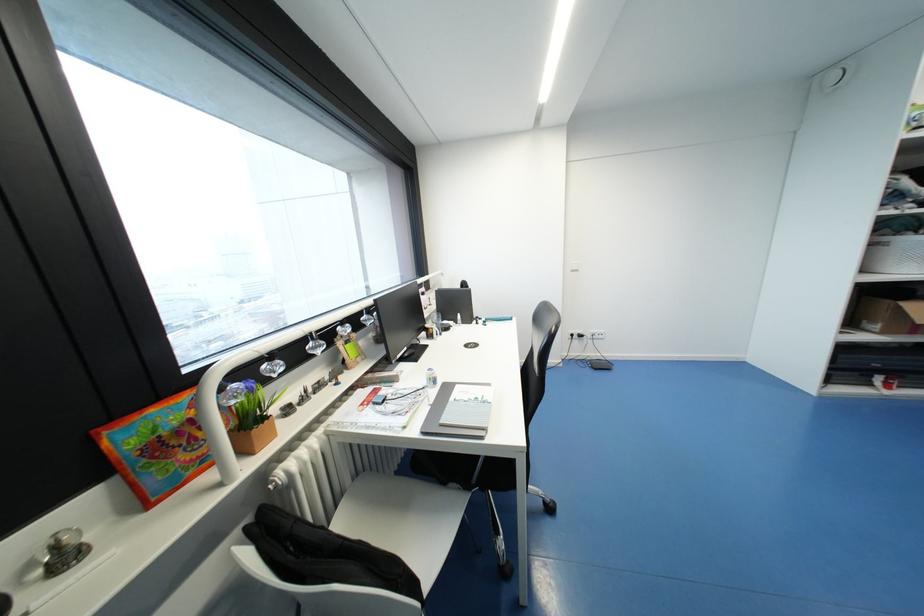
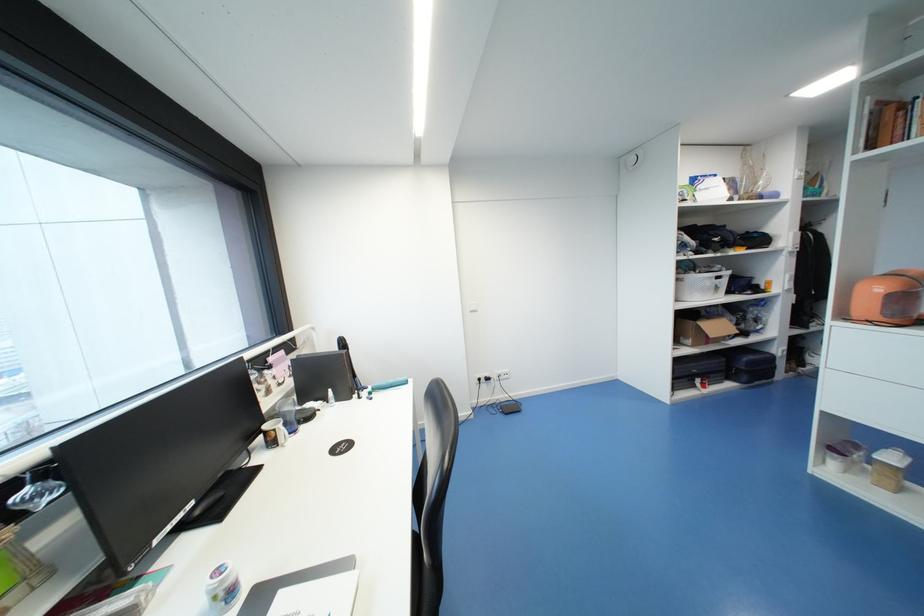
Find the pixel in the second image that matches (878,323) in the first image.

(690, 339)